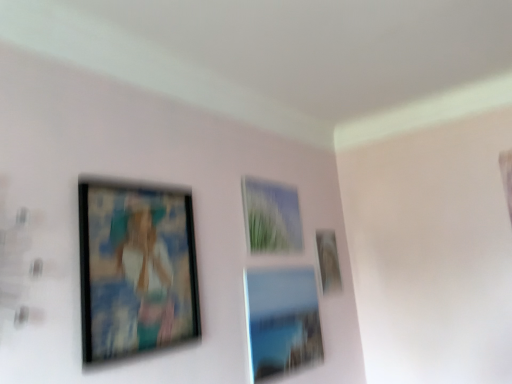
Question: Considering the relative sizes of matte black picture frame at left, the first picture frame in the left-to-right sequence, and matte glass picture frame at center, acting as the 2th picture frame starting from the left, in the image provided, is matte black picture frame at left, the first picture frame in the left-to-right sequence, wider than matte glass picture frame at center, acting as the 2th picture frame starting from the left,?

Choices:
 (A) no
 (B) yes

Answer: (B)

Question: Considering the relative sizes of matte black picture frame at left, placed as the 4th picture frame when sorted from right to left, and matte glass picture frame at center, the third picture frame when ordered from right to left, in the image provided, is matte black picture frame at left, placed as the 4th picture frame when sorted from right to left, taller than matte glass picture frame at center, the third picture frame when ordered from right to left,?

Choices:
 (A) no
 (B) yes

Answer: (B)

Question: Does matte black picture frame at left, the first picture frame in the left-to-right sequence, have a lesser width compared to matte glass picture frame at center, acting as the 2th picture frame starting from the left?

Choices:
 (A) no
 (B) yes

Answer: (A)

Question: Is matte black picture frame at left, the first picture frame in the left-to-right sequence, at the right side of matte glass picture frame at center, the third picture frame when ordered from right to left?

Choices:
 (A) yes
 (B) no

Answer: (B)

Question: Is matte glass picture frame at center, acting as the 2th picture frame starting from the left, at the back of matte black picture frame at left, placed as the 4th picture frame when sorted from right to left?

Choices:
 (A) no
 (B) yes

Answer: (A)

Question: Relative to matte glass picture frame at center, acting as the 2th picture frame starting from the left, is matte glass picture frame at center, which ranks as the 2th picture frame in right-to-left order, in front or behind?

Choices:
 (A) behind
 (B) front

Answer: (B)

Question: In terms of width, does matte glass picture frame at center, the third picture frame viewed from the left, look wider or thinner when compared to matte glass picture frame at center, acting as the 2th picture frame starting from the left?

Choices:
 (A) thin
 (B) wide

Answer: (B)

Question: Looking at the image, does matte glass picture frame at center, which ranks as the 2th picture frame in right-to-left order, seem bigger or smaller compared to matte glass picture frame at center, acting as the 2th picture frame starting from the left?

Choices:
 (A) small
 (B) big

Answer: (B)

Question: Considering the positions of point (314, 294) and point (295, 233), is point (314, 294) closer or farther from the camera than point (295, 233)?

Choices:
 (A) closer
 (B) farther

Answer: (B)

Question: Considering the positions of matte glass picture frame at center, the third picture frame when ordered from right to left, and matte glass picture frame at center, which ranks as the 2th picture frame in right-to-left order, in the image, is matte glass picture frame at center, the third picture frame when ordered from right to left, taller or shorter than matte glass picture frame at center, which ranks as the 2th picture frame in right-to-left order,?

Choices:
 (A) short
 (B) tall

Answer: (A)

Question: From a real-world perspective, relative to matte glass picture frame at center, which ranks as the 2th picture frame in right-to-left order, is matte glass picture frame at center, the third picture frame when ordered from right to left, vertically above or below?

Choices:
 (A) above
 (B) below

Answer: (A)

Question: From the image's perspective, relative to matte glass picture frame at center, the third picture frame viewed from the left, is matte glass picture frame at center, acting as the 2th picture frame starting from the left, above or below?

Choices:
 (A) above
 (B) below

Answer: (A)

Question: Which is correct: matte glass picture frame at center, acting as the 2th picture frame starting from the left, is inside matte glass picture frame at center, the third picture frame viewed from the left, or outside of it?

Choices:
 (A) inside
 (B) outside

Answer: (B)

Question: Is point (131, 289) closer or farther from the camera than point (326, 236)?

Choices:
 (A) farther
 (B) closer

Answer: (B)

Question: Is matte black picture frame at left, the first picture frame in the left-to-right sequence, wider or thinner than matte glass picture frame at upper right, the 4th picture frame positioned from the left?

Choices:
 (A) thin
 (B) wide

Answer: (B)